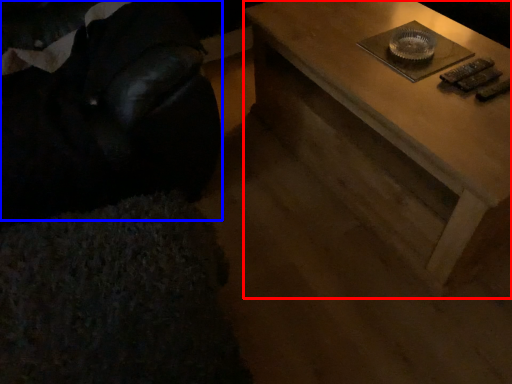
Question: Among these objects, which one is farthest to the camera, table (highlighted by a red box) or bean bag chair (highlighted by a blue box)?

Choices:
 (A) table
 (B) bean bag chair

Answer: (A)